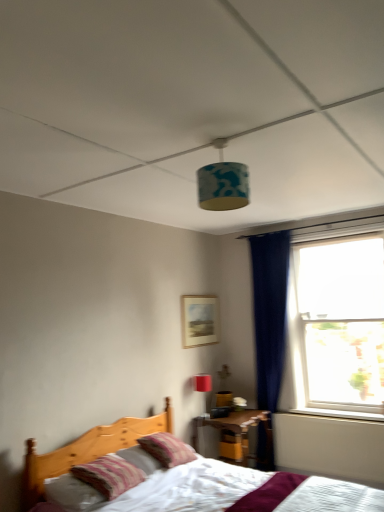
You are a GUI agent. You are given a task and a screenshot of the screen. Output one action in this format:
    pyautogui.click(x=<x>, y=<y>)
    Task: Click on the free spot below matte red table lamp at upper center (from a real-world perspective)
    The image size is (384, 512).
    Given the screenshot: What is the action you would take?
    pyautogui.click(x=200, y=417)